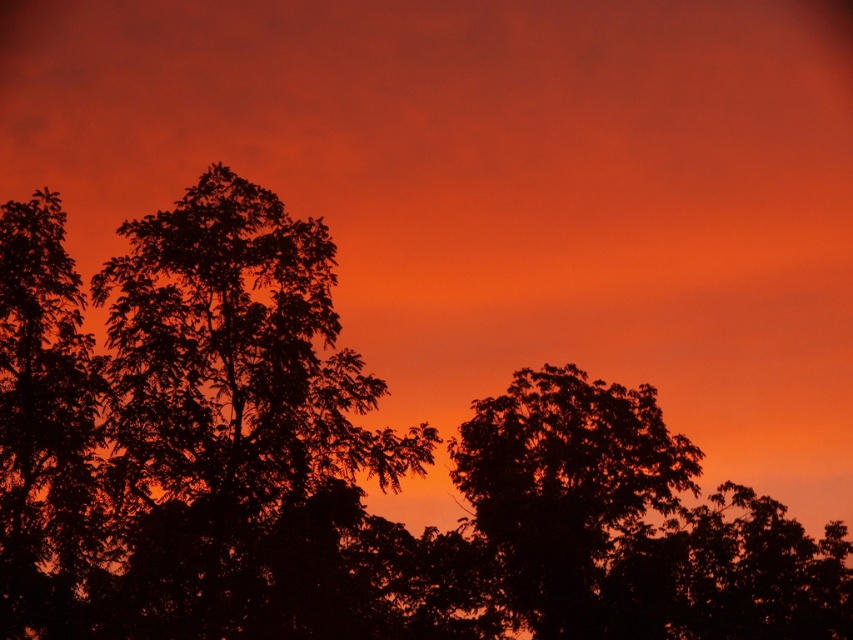
You are an artist trying to paint the sunset scene. You want to ensure the trees are positioned correctly in terms of depth. Which tree should you paint first to create the illusion of depth between the silhouette leafy tree at center and the silhouette tree at center?

You should paint the silhouette leafy tree at center first because it is closer to the viewer, so it should be placed over the silhouette tree at center to create the illusion of depth.